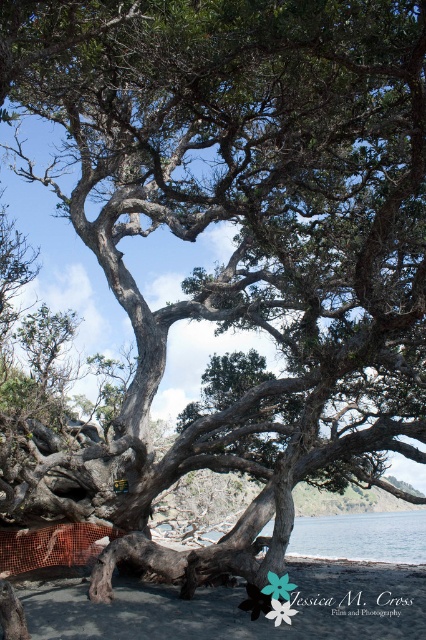
Between smooth sand at lower center and blue water at lower center, which one is positioned higher?

smooth sand at lower center is higher up.

Can you confirm if smooth sand at lower center is wider than blue water at lower center?

Incorrect, smooth sand at lower center's width does not surpass blue water at lower center's.

Who is more forward, (36, 634) or (396, 541)?

Point (36, 634) is more forward.

This screenshot has height=640, width=426. Find the location of `smooth sand at lower center`. smooth sand at lower center is located at coordinates (230, 605).